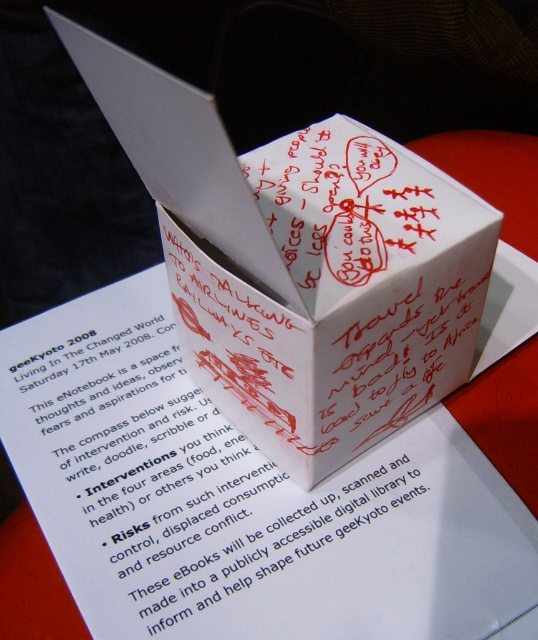
You are organizing a conference and need to place a name tag on the table. The name tag must be placed above the white paper cube at center. Can you place the name tag on the white paper at center?

The white paper at center is located below the white paper cube at center, so placing the name tag on the white paper at center would place it below the cube, not above it. Therefore, the name tag cannot be placed there to meet the requirement.

Based on the scene described, which of the two points, point (73, 380) or point (218, 118), is positioned further away from the viewer?

Point (73, 380) is positioned further away from the viewer than point (218, 118).

You are organizing a display for an event and have a white paper at center with event details and a white paper cube at center with creative phrases. If you want to place both items side by side on a shelf, which one should you place first to ensure they both fit?

The white paper at center might be wider than white paper cube at center, so you should place the white paper at center first to ensure both items fit side by side on the shelf.